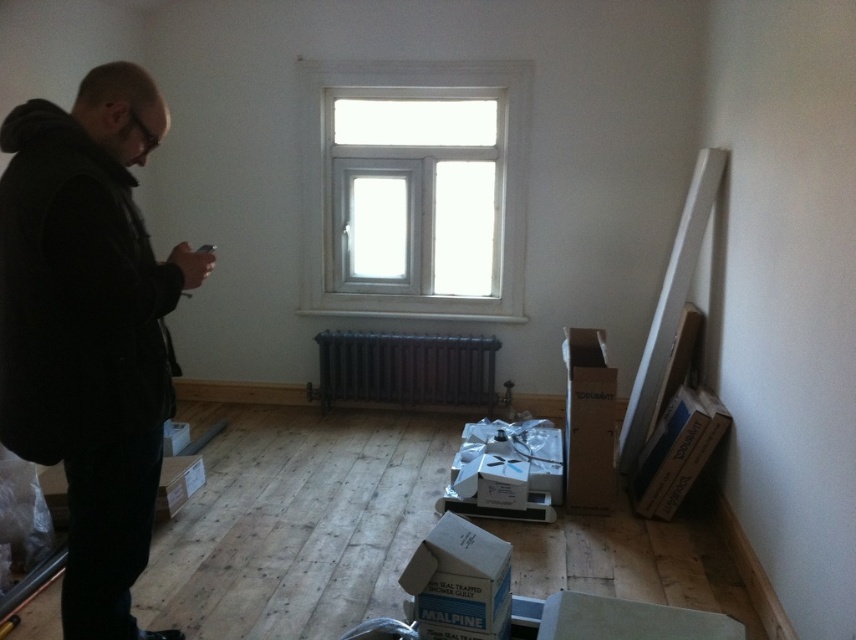
You are organizing a space and need to place a small decorative item on the surface near the black matte jacket at left and the white plastic window at upper center. Which object should you place it closer to if you want it to be proportionally balanced with their sizes?

Since the black matte jacket at left is smaller than the white plastic window at upper center, you should place the decorative item closer to the white plastic window at upper center to achieve a proportional balance.

Where is the black matte jacket at left located in the image?

The black matte jacket at left is located at point (90,330) in the image.

You are a delivery person entering the room and need to place a large package on the floor. The package must be placed between the white plastic window at upper center and the black cast iron radiator at center. Can you fit the package there?

The white plastic window at upper center is closer to the viewer than the black cast iron radiator at center, so there is space between them. The package can be placed between the white plastic window at upper center and the black cast iron radiator at center.